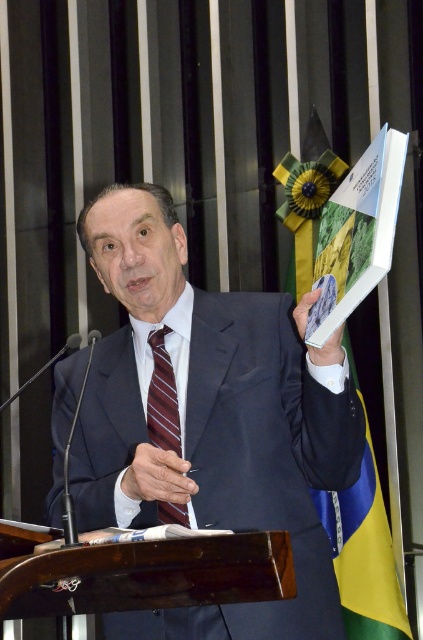
Measure the distance between gray suit at center and maroon striped tie at center.

They are 14.32 centimeters apart.

Does gray suit at center have a greater height compared to maroon striped tie at center?

Indeed, gray suit at center has a greater height compared to maroon striped tie at center.

Between point (293, 458) and point (161, 428), which one is positioned behind?

Point (161, 428)

The height and width of the screenshot is (640, 423). What are the coordinates of `gray suit at center` in the screenshot? It's located at (209, 420).

Does yellow-green fabric flag at upper right have a lesser width compared to maroon striped tie at center?

In fact, yellow-green fabric flag at upper right might be wider than maroon striped tie at center.

Between point (371, 605) and point (170, 396), which one is positioned in front?

Point (170, 396) is in front.

What do you see at coordinates (364, 556) in the screenshot?
I see `yellow-green fabric flag at upper right` at bounding box center [364, 556].

The width and height of the screenshot is (423, 640). Find the location of `yellow-green fabric flag at upper right`. yellow-green fabric flag at upper right is located at coordinates (364, 556).

Who is lower down, gray suit at center or yellow-green fabric flag at upper right?

gray suit at center is below.

What do you see at coordinates (209, 420) in the screenshot?
I see `gray suit at center` at bounding box center [209, 420].

Locate an element on the screen. This screenshot has height=640, width=423. gray suit at center is located at coordinates (209, 420).